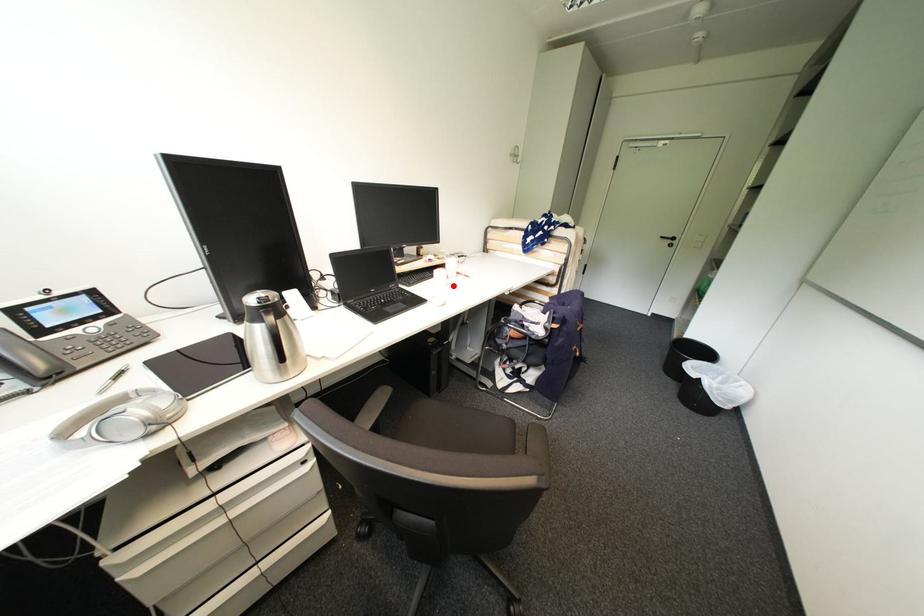
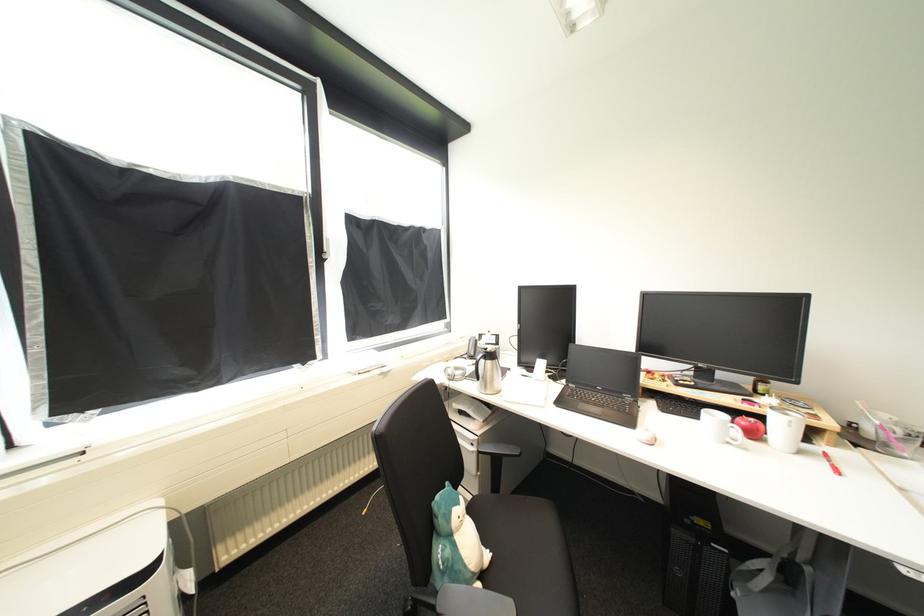
Where in the second image is the point corresponding to the highlighted location from the first image?

(736, 445)